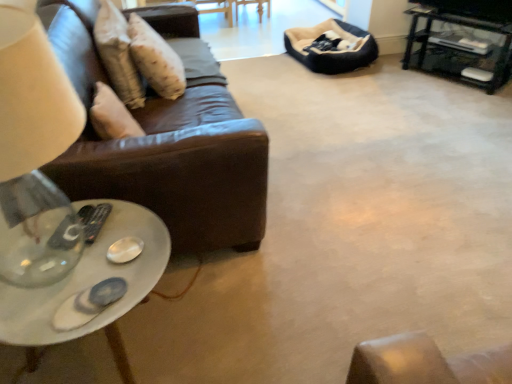
Identify the location of vacant area that is situated to the right of black plastic remote at lower left. (133, 228).